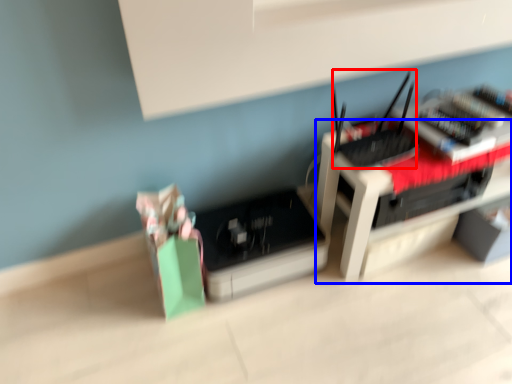
Question: Among these objects, which one is farthest to the camera, register (highlighted by a red box) or furniture (highlighted by a blue box)?

Choices:
 (A) register
 (B) furniture

Answer: (B)